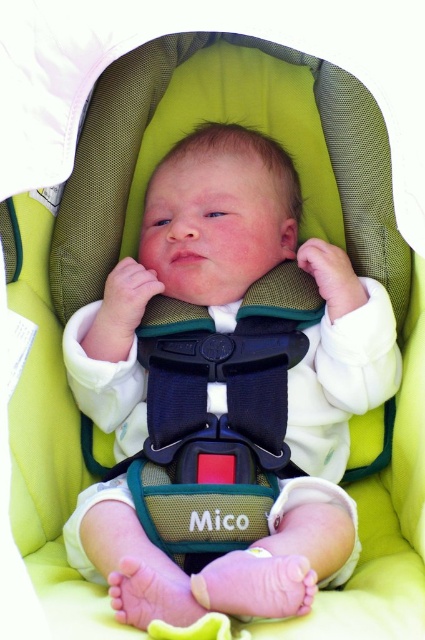
Is white soft baby at center to the right of black plastic buckle at center from the viewer's perspective?

Yes, white soft baby at center is to the right of black plastic buckle at center.

Does point (147, 220) lie behind point (158, 440)?

Yes, it is.

You are a GUI agent. You are given a task and a screenshot of the screen. Output one action in this format:
    pyautogui.click(x=<x>, y=<y>)
    Task: Click on the white soft baby at center
    This screenshot has width=425, height=640.
    Given the screenshot: What is the action you would take?
    click(227, 330)